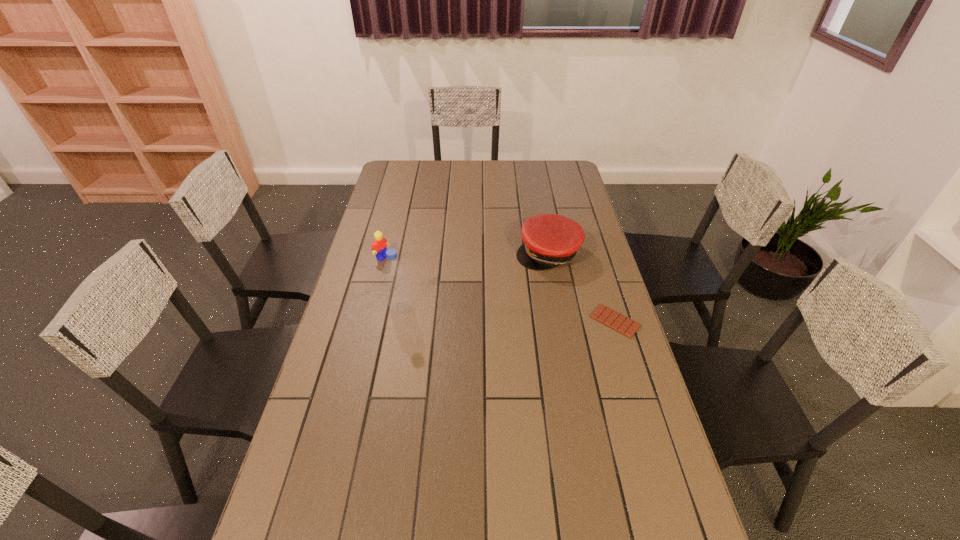
Choose which object is the third nearest neighbor to the candy bar. Please provide its 2D coordinates. Your answer should be formatted as a tuple, i.e. [(x, y)], where the tuple contains the x and y coordinates of a point satisfying the conditions above.

[(379, 245)]

Choose which object is the second nearest neighbor to the cap. Please provide its 2D coordinates. Your answer should be formatted as a tuple, i.e. [(x, y)], where the tuple contains the x and y coordinates of a point satisfying the conditions above.

[(397, 289)]

Identify the location of vacant region that satisfies the following two spatial constraints: 1. on the back side of the third object from right to left; 2. on the right side of the cap. (411, 253).

Identify the location of free spot that satisfies the following two spatial constraints: 1. on the back side of the bottle; 2. on the right side of the cap. (411, 253).

Where is `vacant space that satisfies the following two spatial constraints: 1. on the back side of the cap; 2. on the right side of the bottle`? The image size is (960, 540). vacant space that satisfies the following two spatial constraints: 1. on the back side of the cap; 2. on the right side of the bottle is located at coordinates pos(411,253).

At what (x,y) coordinates should I click in order to perform the action: click on vacant space that satisfies the following two spatial constraints: 1. on the front side of the Lego; 2. on the right side of the bottle. Please return your answer as a coordinate pair (x, y). This screenshot has width=960, height=540. Looking at the image, I should click on (369, 308).